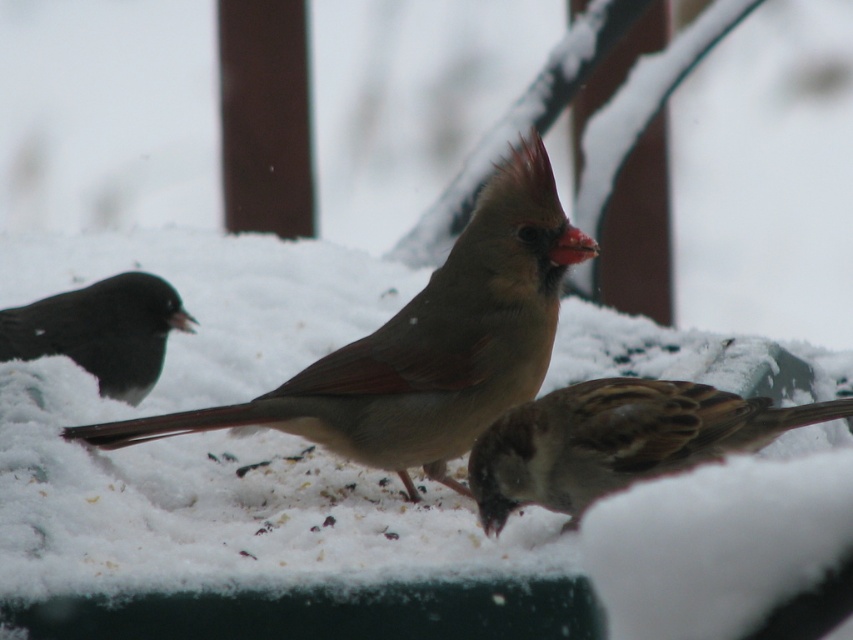
You are a photographer trying to capture a photo of the brown speckled sparrow at center and the brown speckled sparrow at lower right. Based on their positions, which sparrow would appear closer to the camera in the photo?

The brown speckled sparrow at lower right would appear closer to the camera because it is positioned lower than the brown speckled sparrow at center, which is above it.

Based on the photo, you are standing in the snowy outdoor scene and want to walk towards the two points marked in the image. Which point, point (811, 403) or point (148, 378), will you reach first?

Point (811, 403) is closer to the viewer than point (148, 378), so you will reach point (811, 403) first.